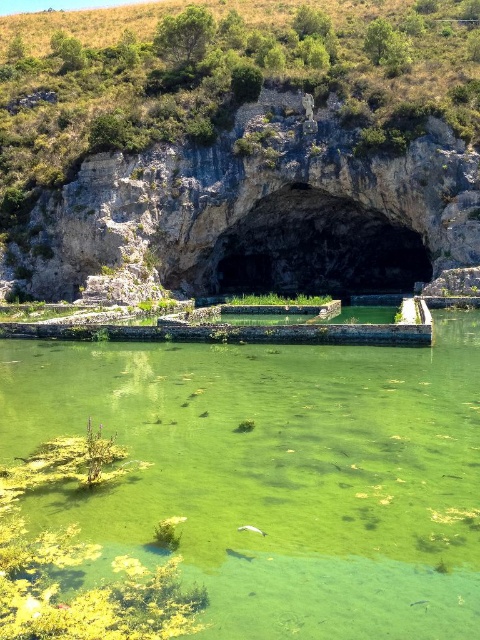
Does rocky cliff at center lie in front of green algae pond at center?

No, rocky cliff at center is behind green algae pond at center.

Based on the photo, can you confirm if rocky cliff at center is positioned below green algae pond at center?

Actually, rocky cliff at center is above green algae pond at center.

Describe the element at coordinates (243, 147) in the screenshot. Image resolution: width=480 pixels, height=640 pixels. I see `rocky cliff at center` at that location.

Image resolution: width=480 pixels, height=640 pixels. Identify the location of rocky cliff at center. (243, 147).

Can you confirm if rocky cliff at center is taller than black stone cave at center?

Indeed, rocky cliff at center has a greater height compared to black stone cave at center.

Who is shorter, rocky cliff at center or black stone cave at center?

black stone cave at center

Image resolution: width=480 pixels, height=640 pixels. What are the coordinates of `rocky cliff at center` in the screenshot? It's located at (243, 147).

Is the position of green algae pond at center more distant than that of black stone cave at center?

No.

Between green algae pond at center and black stone cave at center, which one has more height?

black stone cave at center is taller.

Does point (287, 428) come behind point (284, 193)?

No, (287, 428) is in front of (284, 193).

Locate an element on the screen. green algae pond at center is located at coordinates (276, 474).